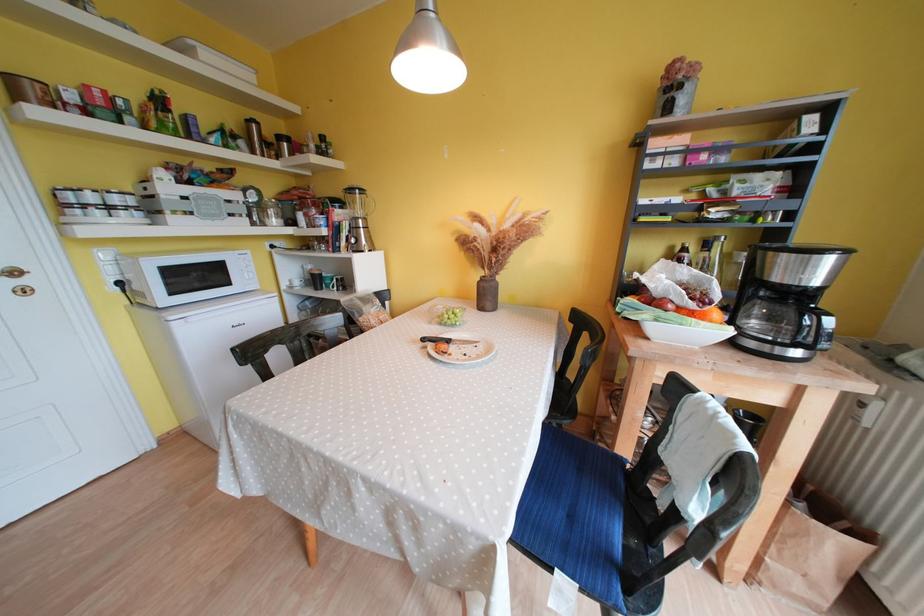
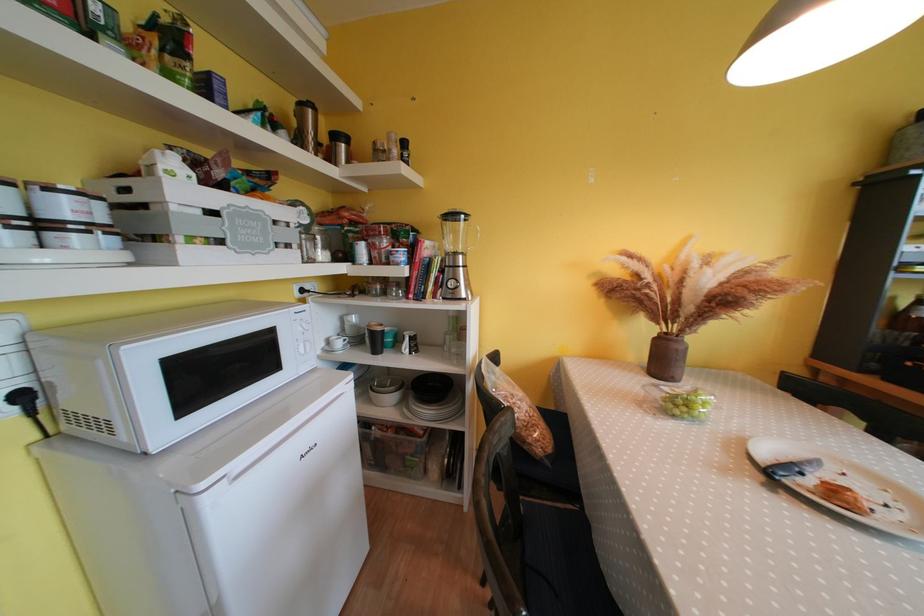
In the second image, find the point that corresponds to [492,289] in the first image.

(687, 351)